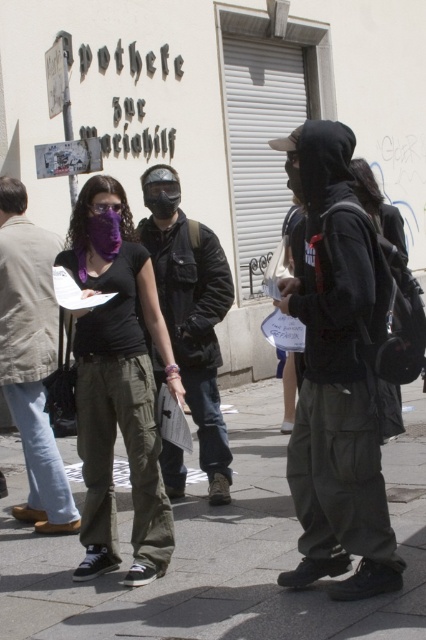
Question: Can you confirm if dark green cargo pants at center is smaller than denim pants at center?

Choices:
 (A) yes
 (B) no

Answer: (B)

Question: Is matte black helmet at center thinner than denim pants at center?

Choices:
 (A) yes
 (B) no

Answer: (B)

Question: Among these points, which one is nearest to the camera?

Choices:
 (A) (100, 202)
 (B) (192, 228)
 (C) (141, 372)

Answer: (C)

Question: Among these objects, which one is nearest to the camera?

Choices:
 (A) matte black shirt at center
 (B) purple matte goggles at center

Answer: (A)

Question: Which point appears closest to the camera in this image?

Choices:
 (A) (203, 365)
 (B) (348, 140)
 (C) (92, 209)

Answer: (B)

Question: Observing the image, what is the correct spatial positioning of denim pants at center in reference to purple matte goggles at center?

Choices:
 (A) left
 (B) right

Answer: (A)